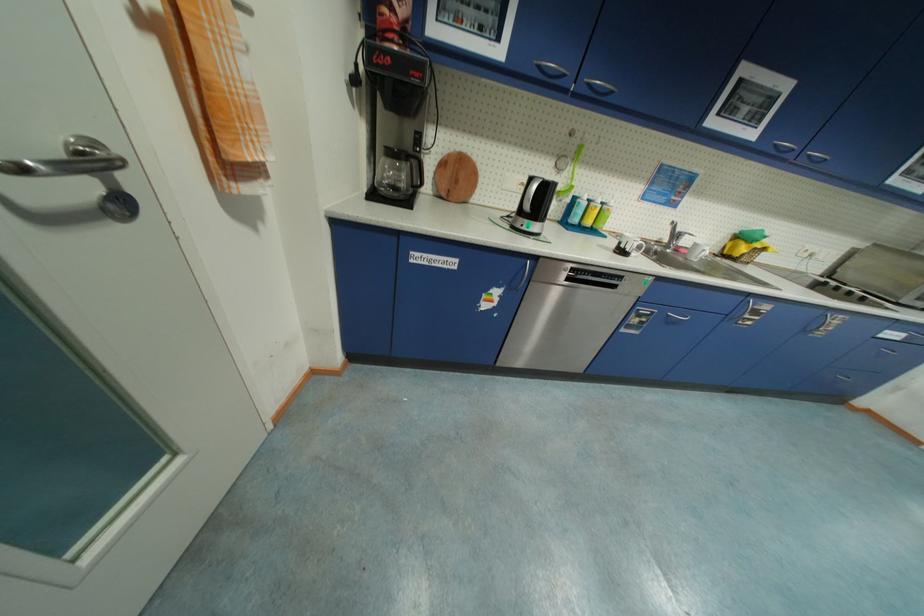
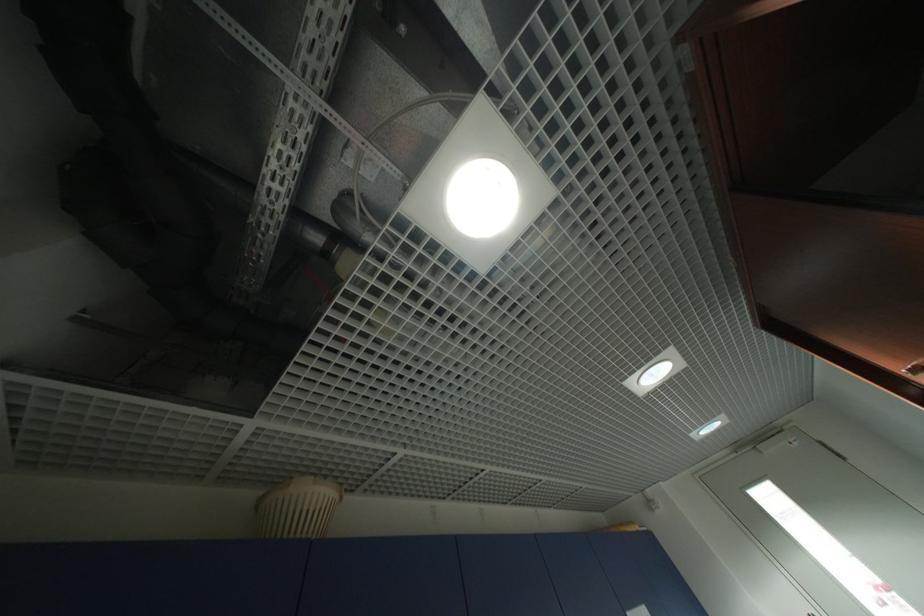
The images are taken continuously from a first-person perspective. In which direction is your viewpoint rotating?

The camera rotated toward right-up.